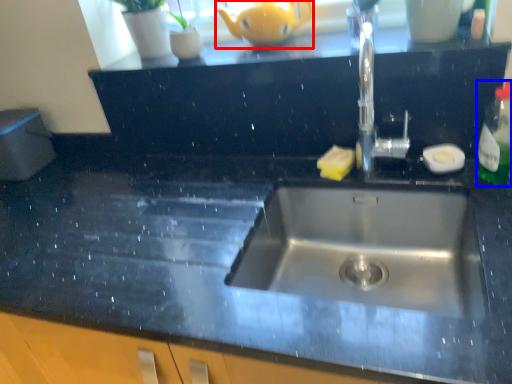
Question: Which object appears farthest to the camera in this image, tea pot (highlighted by a red box) or bottle (highlighted by a blue box)?

Choices:
 (A) tea pot
 (B) bottle

Answer: (A)